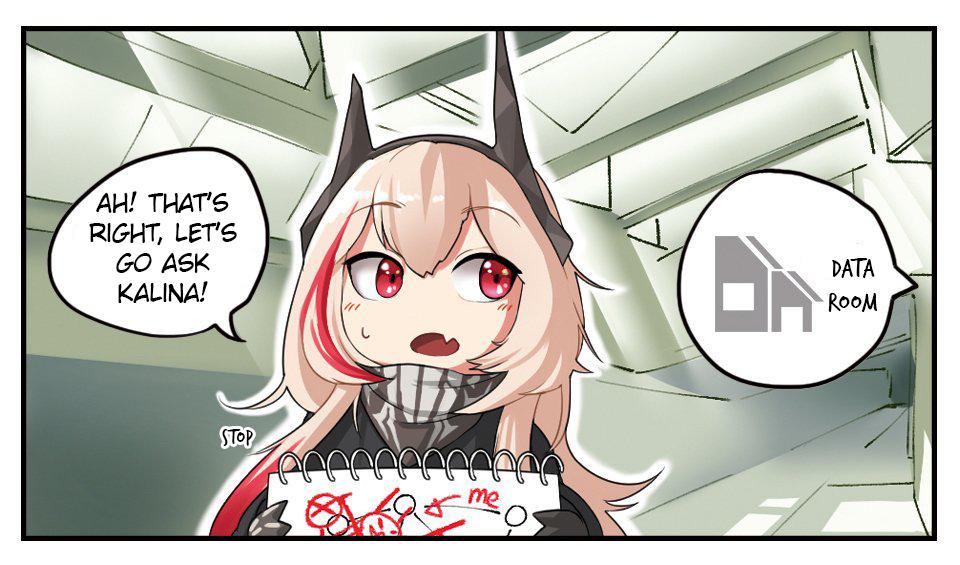
Find the location of a particular element. This screenshot has width=960, height=565. hallway is located at coordinates (861, 396).